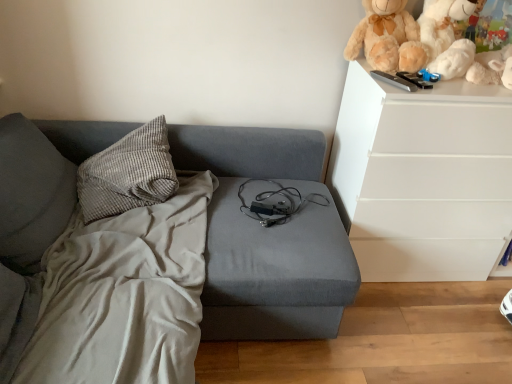
Question: Is white plush teddy bear at upper right inside the boundaries of gray corduroy pillow at upper left, or outside?

Choices:
 (A) outside
 (B) inside

Answer: (A)

Question: Considering the positions of point (425, 23) and point (166, 152), is point (425, 23) closer or farther from the camera than point (166, 152)?

Choices:
 (A) farther
 (B) closer

Answer: (B)

Question: Estimate the real-world distances between objects in this image. Which object is closer to the fluffy beige teddy bear at upper right?

Choices:
 (A) gray corduroy pillow at upper left
 (B) white plush toy at upper right
 (C) white plush teddy bear at upper right

Answer: (B)

Question: Which object is positioned farthest from the fluffy beige teddy bear at upper right?

Choices:
 (A) gray corduroy pillow at upper left
 (B) white plush teddy bear at upper right
 (C) white plush toy at upper right

Answer: (A)